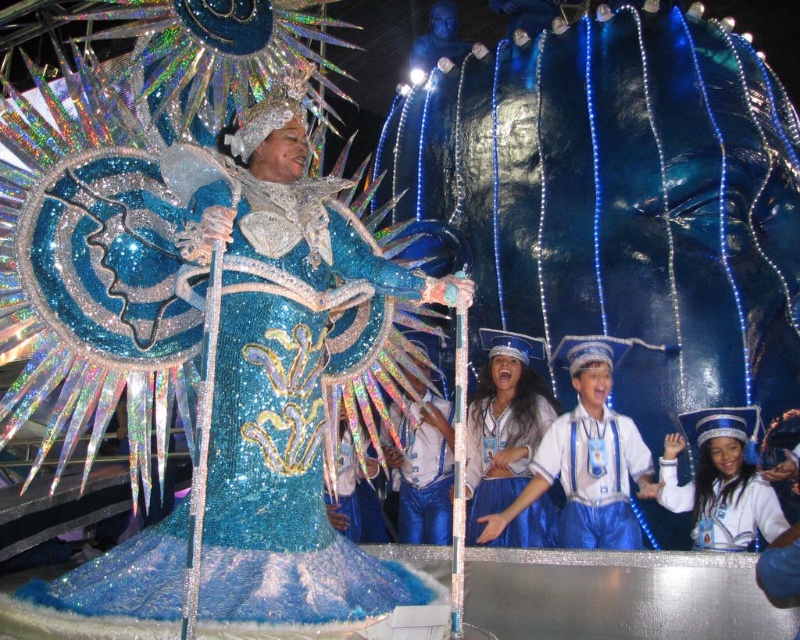
Question: Can you confirm if sparkly blue dress at center is positioned below blue sequined skirt at center?

Choices:
 (A) yes
 (B) no

Answer: (B)

Question: Which point is farther to the camera?

Choices:
 (A) shiny blue uniform at center
 (B) shiny blue hat at lower right

Answer: (A)

Question: Which of the following is the farthest from the observer?

Choices:
 (A) (440, 492)
 (B) (520, 532)

Answer: (A)

Question: Does blue sequined costume at center have a larger size compared to blue sequined skirt at center?

Choices:
 (A) yes
 (B) no

Answer: (B)

Question: Is shiny blue uniform at center above blue sequined pants at center?

Choices:
 (A) no
 (B) yes

Answer: (B)

Question: Which point is closer to the camera taking this photo?

Choices:
 (A) (750, 499)
 (B) (628, 512)
 (C) (254, 276)
 (D) (412, 426)

Answer: (C)